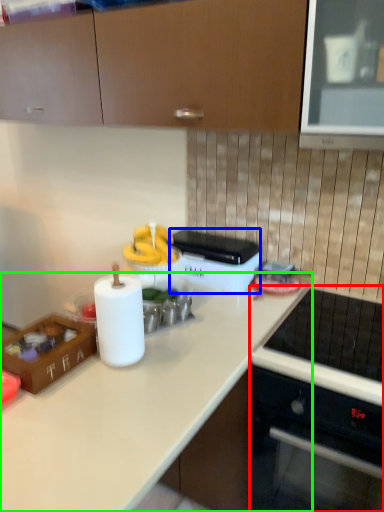
Question: Which is farther away from home appliance (highlighted by a red box)? appliance (highlighted by a blue box) or countertop (highlighted by a green box)?

Choices:
 (A) appliance
 (B) countertop

Answer: (A)